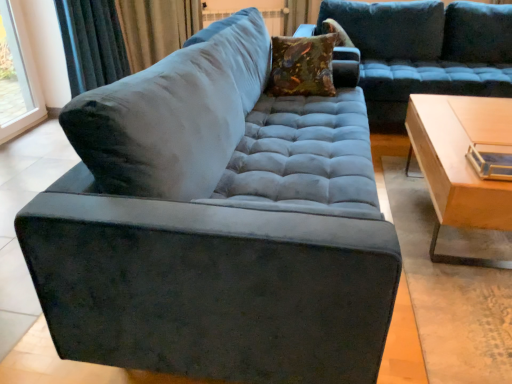
Question: Considering the relative positions of light wood/wooden table at right and velvet floral pillow at center, which is counted as the first pillow, starting from the bottom, in the image provided, is light wood/wooden table at right to the left of velvet floral pillow at center, which is counted as the first pillow, starting from the bottom, from the viewer's perspective?

Choices:
 (A) no
 (B) yes

Answer: (A)

Question: Is light wood/wooden table at right wider than velvet floral pillow at center, the second pillow viewed from the right?

Choices:
 (A) no
 (B) yes

Answer: (B)

Question: Is velvet floral pillow at center, placed as the 2th pillow when sorted from top to bottom, surrounded by light wood/wooden table at right?

Choices:
 (A) no
 (B) yes

Answer: (A)

Question: Is light wood/wooden table at right not near velvet floral pillow at center, which is counted as the first pillow, starting from the bottom?

Choices:
 (A) no
 (B) yes

Answer: (A)

Question: Is the depth of light wood/wooden table at right greater than that of velvet floral pillow at center, positioned as the second pillow in back-to-front order?

Choices:
 (A) no
 (B) yes

Answer: (A)

Question: Based on their sizes in the image, would you say velvet curtain at upper left is bigger or smaller than velvet floral pillow at center, which is counted as the first pillow, starting from the bottom?

Choices:
 (A) small
 (B) big

Answer: (B)

Question: From the image's perspective, is velvet curtain at upper left located above or below velvet floral pillow at center, which is counted as the 1th pillow, starting from the left?

Choices:
 (A) above
 (B) below

Answer: (A)

Question: From a real-world perspective, is velvet curtain at upper left positioned above or below velvet floral pillow at center, which is counted as the first pillow, starting from the bottom?

Choices:
 (A) above
 (B) below

Answer: (B)

Question: Would you say velvet curtain at upper left is inside or outside velvet floral pillow at center, positioned as the second pillow in back-to-front order?

Choices:
 (A) outside
 (B) inside

Answer: (A)

Question: In the image, is velvet-like brown pillow at upper center, which appears as the second pillow when viewed from the front, on the left side or the right side of velvet floral pillow at center, which is the first pillow in front-to-back order?

Choices:
 (A) right
 (B) left

Answer: (A)

Question: Is point (348, 44) closer or farther from the camera than point (283, 64)?

Choices:
 (A) farther
 (B) closer

Answer: (A)

Question: Is velvet-like brown pillow at upper center, acting as the first pillow starting from the right, bigger or smaller than velvet floral pillow at center, placed as the 2th pillow when sorted from top to bottom?

Choices:
 (A) small
 (B) big

Answer: (A)

Question: Considering their positions, is velvet-like brown pillow at upper center, acting as the first pillow starting from the right, located in front of or behind velvet floral pillow at center, which is counted as the 1th pillow, starting from the left?

Choices:
 (A) front
 (B) behind

Answer: (B)

Question: Is velvet floral pillow at center, positioned as the second pillow in back-to-front order, wider or thinner than transparent glass window at upper left?

Choices:
 (A) wide
 (B) thin

Answer: (A)

Question: From the image's perspective, is velvet floral pillow at center, which is the first pillow in front-to-back order, positioned above or below transparent glass window at upper left?

Choices:
 (A) below
 (B) above

Answer: (A)